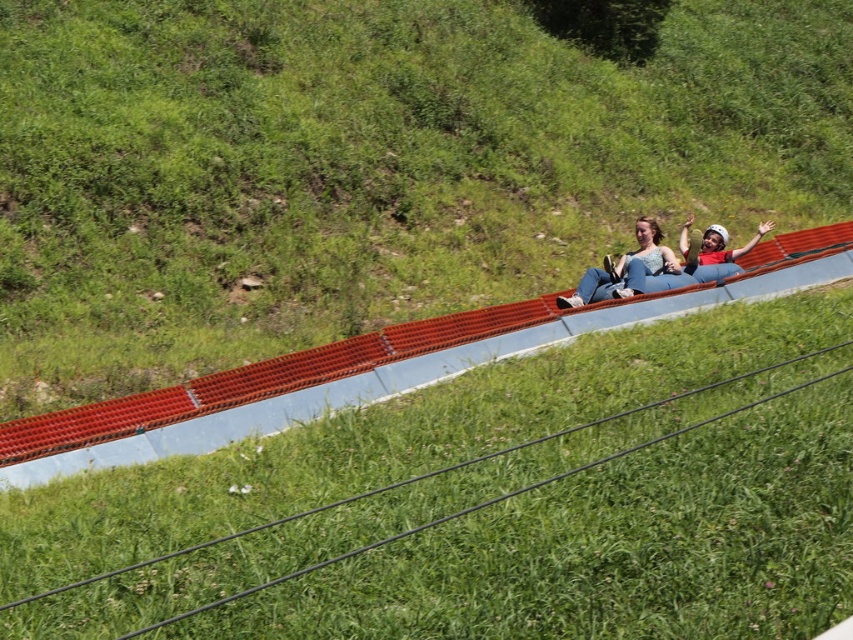
In the scene shown: Does matte blue tube at center appear on the right side of matte blue helmet at center?

In fact, matte blue tube at center is to the left of matte blue helmet at center.

Who is more forward, (613, 272) or (721, 243)?

Point (613, 272)

Is point (585, 301) farther from viewer compared to point (761, 221)?

No, (585, 301) is in front of (761, 221).

Locate an element on the screen. The height and width of the screenshot is (640, 853). matte blue tube at center is located at coordinates (625, 269).

Between red plastic rail at center and matte blue tube at center, which one appears on the right side from the viewer's perspective?

matte blue tube at center

Between red plastic rail at center and matte blue tube at center, which one is positioned lower?

red plastic rail at center

Does point (705, 636) come in front of point (653, 225)?

That is True.

This screenshot has width=853, height=640. I want to click on red plastic rail at center, so click(x=364, y=472).

Between red plastic rail at center and matte blue helmet at center, which one is positioned higher?

matte blue helmet at center is above.

Can you confirm if red plastic rail at center is positioned above matte blue helmet at center?

Actually, red plastic rail at center is below matte blue helmet at center.

Is point (700, 563) behind point (770, 227)?

No, (700, 563) is in front of (770, 227).

You are a GUI agent. You are given a task and a screenshot of the screen. Output one action in this format:
    pyautogui.click(x=<x>, y=<y>)
    Task: Click on the red plastic rail at center
    The height and width of the screenshot is (640, 853).
    Given the screenshot: What is the action you would take?
    pyautogui.click(x=364, y=472)